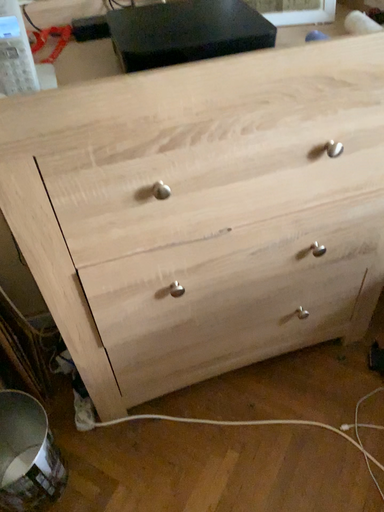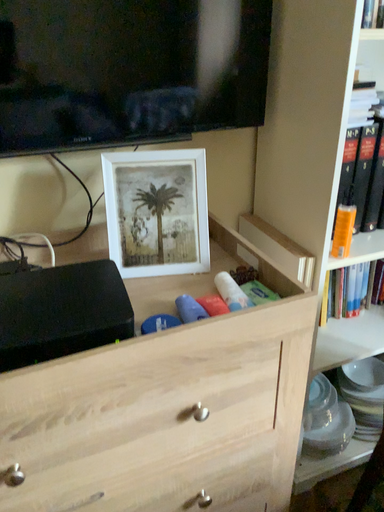
Question: Which way did the camera rotate in the video?

Choices:
 (A) rotated upward
 (B) rotated downward

Answer: (A)